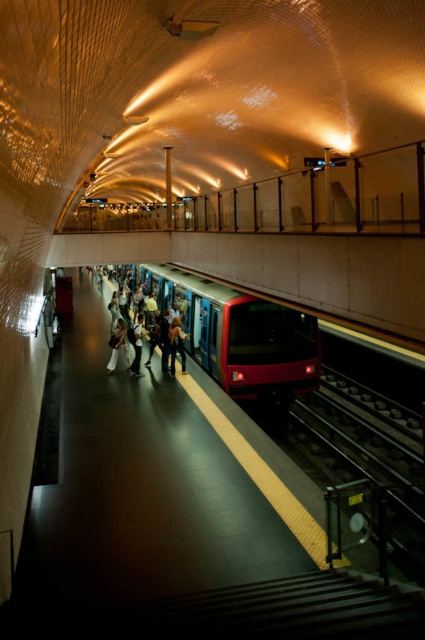
You are a commuter waiting on the subway platform and you see a light beige fabric bag at center and a light beige fabric dress at center. Which item is higher up?

The light beige fabric bag at center is above the light beige fabric dress at center.

You are standing on the subway platform and wearing a light beige fabric dress at center. A train arrives, and you want to board it before the doors close. Considering the train doors are 1.2 meters wide, can you safely walk from your current position to the train doors without any obstacles?

The light beige fabric dress at center is 13.03 meters away from the viewer, which means you are 13.03 meters away from the train doors. Since the doors are only 1.2 meters wide, you need to cover this distance quickly. However, the question does not provide information about the time available before the doors close or any obstacles between you and the train. Without knowing these factors, it is impossible to determine if you can safely board in time.

You are a passenger waiting at the subway station platform. You see two jackets left unattended on a bench at the center of the platform. The jackets are a denim jacket at center and a light beige fabric jacket at center. Which jacket takes up more space horizontally on the bench?

The denim jacket at center has a larger width than the light beige fabric jacket at center, so it takes up more horizontal space on the bench.